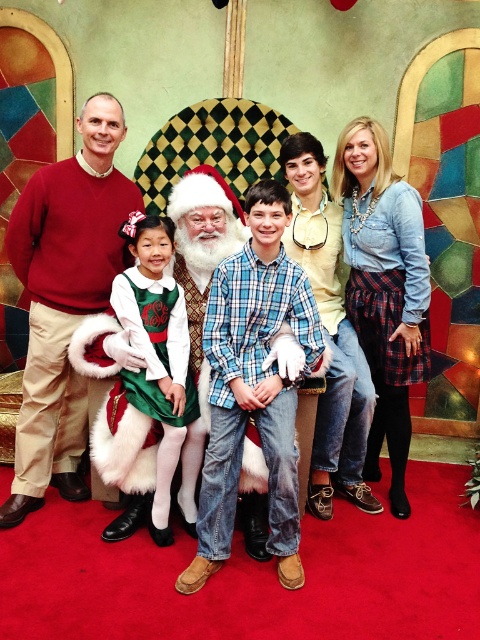
You are a photographer adjusting the lighting for the family portrait. You notice the red sweater at left and the blue plaid shirt at center. Which clothing item is closer to you, the photographer?

The red sweater at left is closer to you because it is further to the viewer than the blue plaid shirt at center.

Based on the photo, you are a photographer who needs to adjust the lighting for the photo. Since the matte black laptop at center and white fluffy santa at center are both in the center, which one might cast a longer shadow given their heights?

The matte black laptop at center is taller than the white fluffy santa at center, so it will cast a longer shadow.